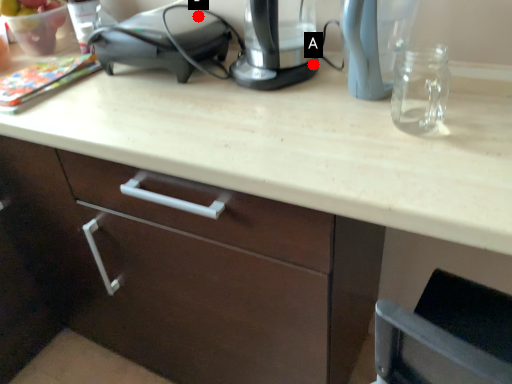
Question: Two points are circled on the image, labeled by A and B beside each circle. Which point is farther to the camera?

Choices:
 (A) A is further
 (B) B is further

Answer: (B)